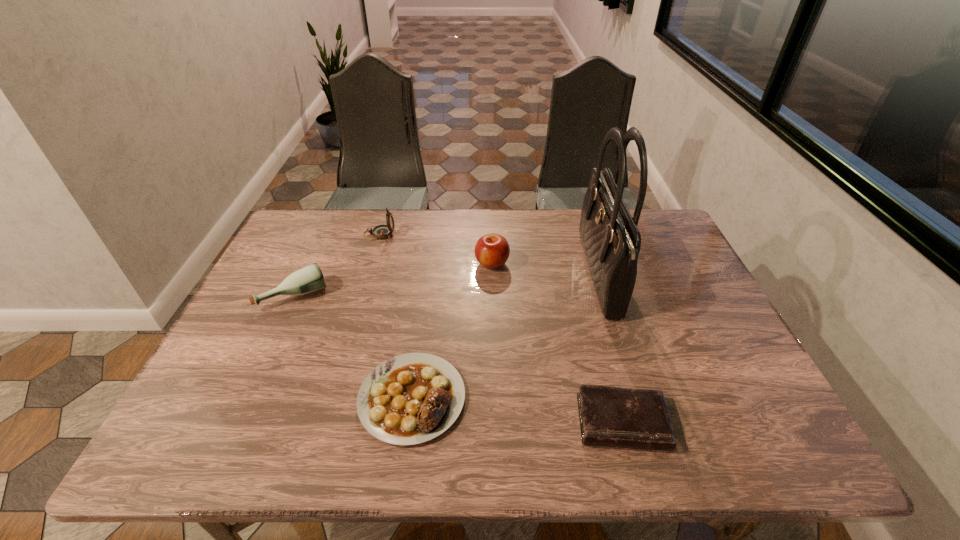
You are a GUI agent. You are given a task and a screenshot of the screen. Output one action in this format:
    pyautogui.click(x=<x>, y=<y>)
    Task: Click on the tallest object
    This screenshot has width=960, height=540.
    Given the screenshot: What is the action you would take?
    pyautogui.click(x=611, y=239)

At what (x,y) coordinates should I click in order to perform the action: click on the fifth object from right to left. Please return your answer as a coordinate pair (x, y). Looking at the image, I should click on (381, 231).

At what (x,y) coordinates should I click in order to perform the action: click on the third object from right to left. Please return your answer as a coordinate pair (x, y). Looking at the image, I should click on (492, 250).

You are a GUI agent. You are given a task and a screenshot of the screen. Output one action in this format:
    pyautogui.click(x=<x>, y=<y>)
    Task: Click on the bottle
    
    Given the screenshot: What is the action you would take?
    pyautogui.click(x=309, y=279)

Where is `the fourth tallest object`? This screenshot has width=960, height=540. the fourth tallest object is located at coordinates (309, 279).

What are the coordinates of `the fourth object from right to left` in the screenshot? It's located at (409, 399).

This screenshot has height=540, width=960. In order to click on steak in this screenshot , I will do `click(409, 399)`.

Locate an element on the screen. This screenshot has height=540, width=960. the shortest object is located at coordinates (609, 416).

Where is `vacant position located with an open clasp on the front of the tallest object`? This screenshot has height=540, width=960. vacant position located with an open clasp on the front of the tallest object is located at coordinates (530, 275).

Find the location of `vacant space located with an open clasp on the front of the tallest object`. vacant space located with an open clasp on the front of the tallest object is located at coordinates pyautogui.click(x=564, y=275).